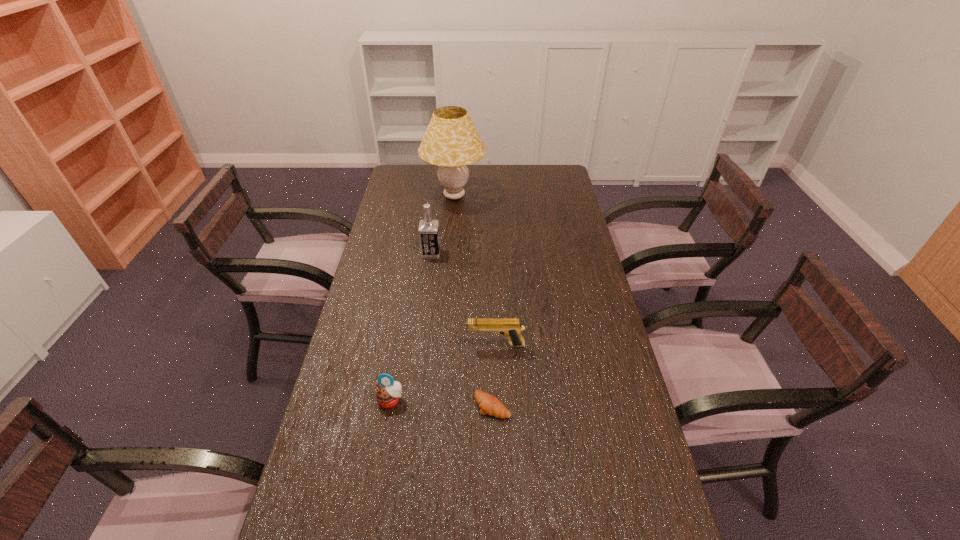
What are the coordinates of `blank area at the right edge` in the screenshot? It's located at (577, 313).

The image size is (960, 540). I want to click on free space at the far left corner, so click(422, 185).

This screenshot has height=540, width=960. What are the coordinates of `free area in between the vodka and the crescent roll` in the screenshot? It's located at (462, 329).

The height and width of the screenshot is (540, 960). What are the coordinates of `vacant area that lies between the pistol and the shortest object` in the screenshot? It's located at (494, 375).

The image size is (960, 540). What are the coordinates of `vacant area between the vodka and the lampshade` in the screenshot? It's located at (443, 225).

I want to click on free spot between the tallest object and the shortest object, so click(x=473, y=301).

Identify the location of free space between the second farthest object and the third nearest object. (464, 299).

Image resolution: width=960 pixels, height=540 pixels. Find the location of `vacant area between the muffin and the crescent roll`. vacant area between the muffin and the crescent roll is located at coordinates (442, 403).

Image resolution: width=960 pixels, height=540 pixels. In order to click on vacant area that lies between the crescent roll and the fourth nearest object in this screenshot , I will do `click(462, 329)`.

This screenshot has width=960, height=540. I want to click on unoccupied area between the third farthest object and the crescent roll, so click(494, 375).